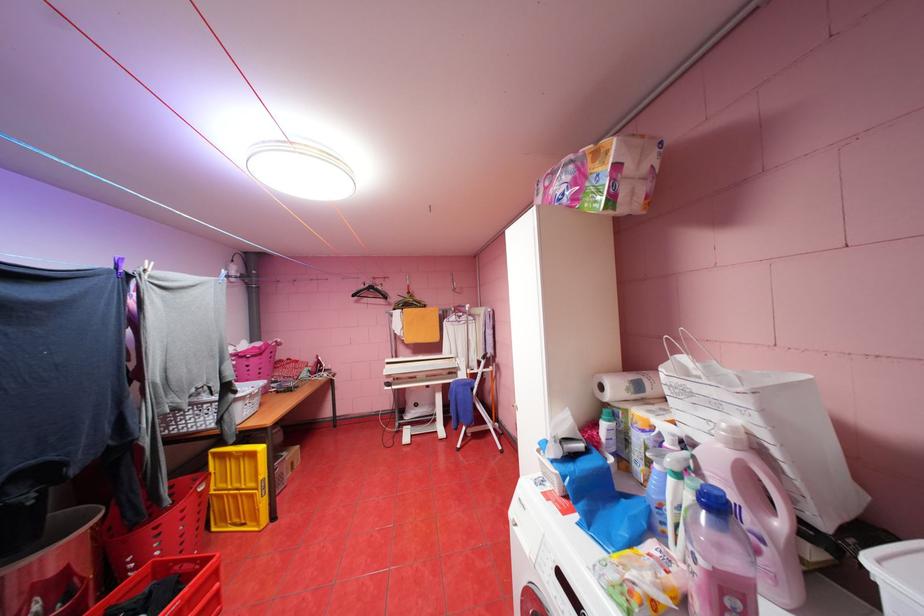
The width and height of the screenshot is (924, 616). I want to click on white bag handle, so click(x=769, y=429).